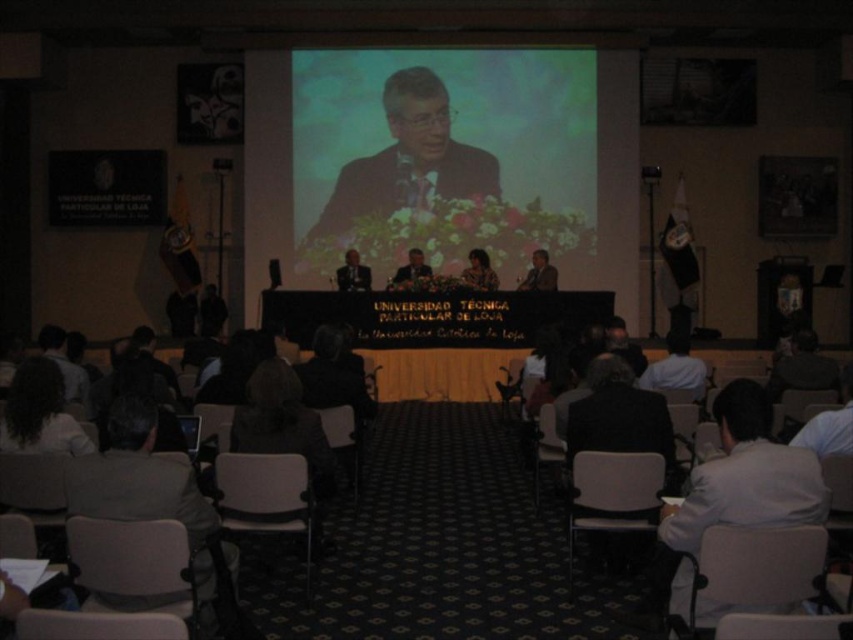
Question: Is gray fabric chair at lower left positioned at the back of matte black chair at center?

Choices:
 (A) no
 (B) yes

Answer: (A)

Question: Considering the real-world distances, which object is farthest from the matte black chair at center?

Choices:
 (A) white shirt at center
 (B) matte gray chair at lower left

Answer: (B)

Question: Can you confirm if gray fabric chair at lower right is positioned to the left of matte black suit at center?

Choices:
 (A) yes
 (B) no

Answer: (B)

Question: Can you confirm if matte black chair at center is positioned above smooth black suit at center?

Choices:
 (A) no
 (B) yes

Answer: (A)

Question: Among these points, which one is nearest to the camera?

Choices:
 (A) (677, 381)
 (B) (248, 486)
 (C) (627, 524)
 (D) (506, 385)

Answer: (B)

Question: Which point is farther to the camera?

Choices:
 (A) gray fabric chair at lower right
 (B) matte black suit at center
 (C) white shirt at lower right
 (D) gray fabric chair at lower left

Answer: (B)